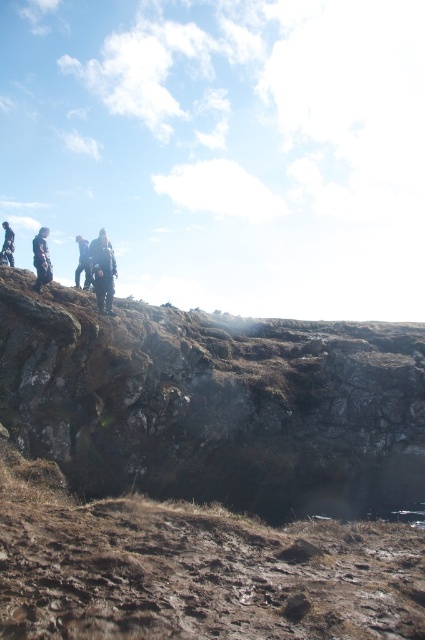
You are part of a hiking group and notice two people in the scene. One is wearing a dark blue jacket at upper center and the other is in dark gray clothing at left. From your perspective, which person is standing to the right of the other?

The dark blue jacket at upper center is positioned on the right side of dark gray clothing at left.

You are a geologist analyzing the image. You need to locate the rough textured rock at center for your study. According to the coordinates provided, where exactly should you look on the image?

The rough textured rock at center is located at point (214, 403) on the image.

You are a photographer trying to capture a photo of the dark blue jacket at upper center. There is a point at coordinates point (102,269) that you need to focus on. Is this point located on the dark blue jacket at upper center?

Yes, the point (102,269) is located on the dark blue jacket at upper center according to the description.